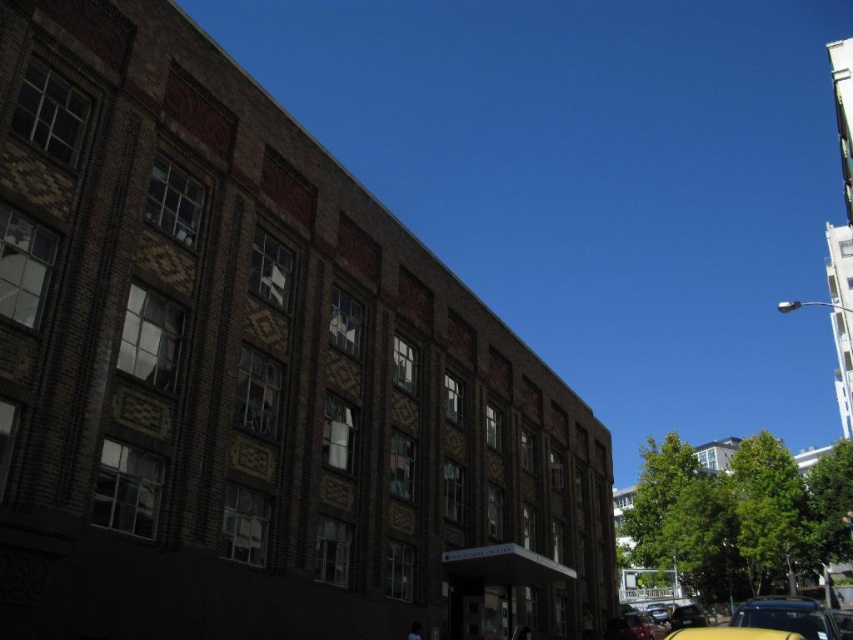
Question: Does yellow matte car at lower right have a greater width compared to yellow rubber taxi at lower right?

Choices:
 (A) no
 (B) yes

Answer: (B)

Question: Which object appears farthest from the camera in this image?

Choices:
 (A) shiny black car at lower right
 (B) yellow rubber taxi at lower right
 (C) yellow matte car at lower right

Answer: (A)

Question: Based on their relative distances, which object is nearer to the yellow rubber taxi at lower right?

Choices:
 (A) shiny black car at lower right
 (B) yellow matte car at lower right

Answer: (B)

Question: Does yellow matte car at lower right have a greater width compared to shiny black car at lower right?

Choices:
 (A) no
 (B) yes

Answer: (B)

Question: Can you confirm if yellow matte car at lower right is positioned below shiny black car at lower right?

Choices:
 (A) no
 (B) yes

Answer: (A)

Question: Which point appears farthest from the camera in this image?

Choices:
 (A) (770, 614)
 (B) (762, 636)

Answer: (A)